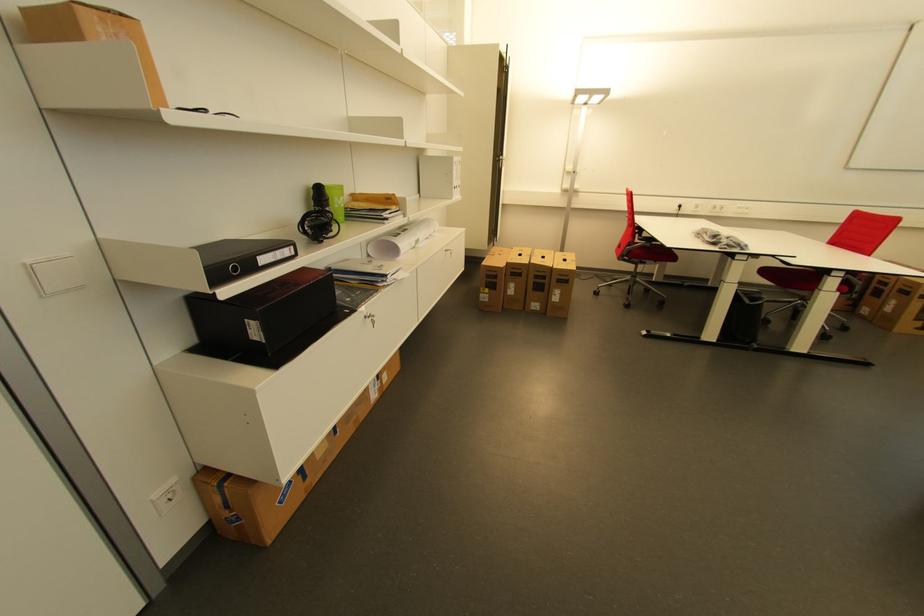
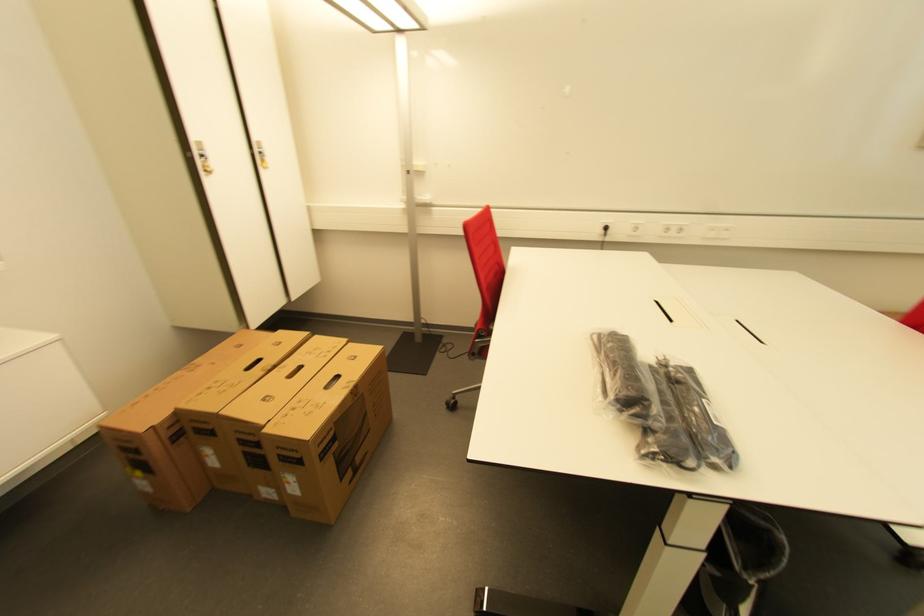
Find the pixel in the second image that matches [723,211] in the first image.

(676, 233)